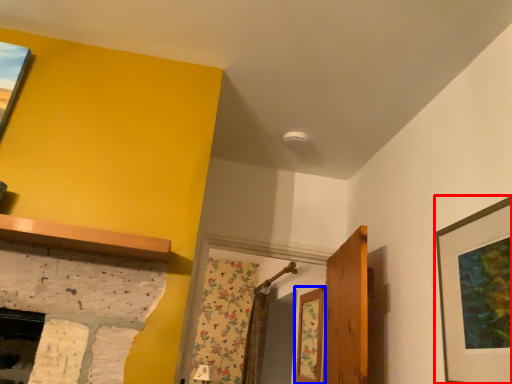
Question: Which object appears closest to the camera in this image, picture frame (highlighted by a red box) or window (highlighted by a blue box)?

Choices:
 (A) picture frame
 (B) window

Answer: (A)